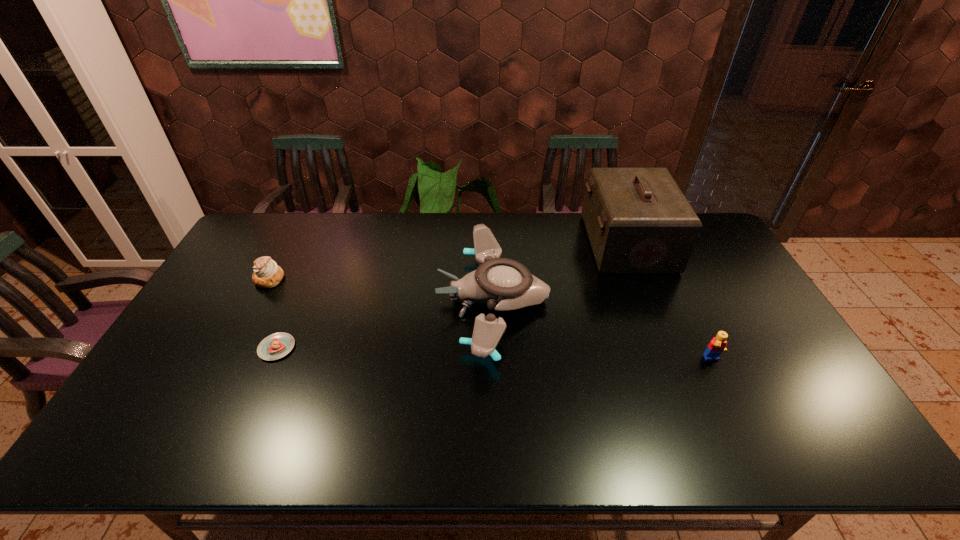
Identify the location of vacant space at the right edge. coord(777,347).

At what (x,y) coordinates should I click in order to perform the action: click on blank space at the far left corner. Please return your answer as a coordinate pair (x, y). Looking at the image, I should click on (245, 240).

Identify the location of vacant space at the near left corner of the desktop. This screenshot has width=960, height=540. (159, 452).

Identify the location of vacant region between the drone and the tallest object. click(x=560, y=272).

Locate an element on the screen. This screenshot has width=960, height=540. free space between the first-aid kit and the Lego is located at coordinates (670, 302).

Identify the location of free space between the shortest object and the leftmost object. This screenshot has height=540, width=960. (273, 314).

I want to click on empty space between the drone and the leftmost object, so click(381, 290).

I want to click on unoccupied position between the Lego and the third object from right to left, so click(603, 330).

Where is `vacant point located between the fourth tallest object and the tallest object`? The width and height of the screenshot is (960, 540). vacant point located between the fourth tallest object and the tallest object is located at coordinates (448, 261).

This screenshot has height=540, width=960. Identify the location of free area in between the drone and the nearer pastry. (385, 324).